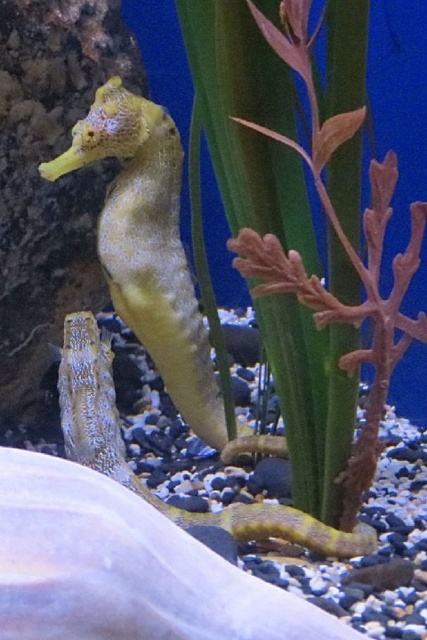
Question: Which point is farther to the camera?

Choices:
 (A) (263, 202)
 (B) (148, 280)

Answer: (B)

Question: Is green matte plant at center smaller than yellow matte seahorse at center?

Choices:
 (A) yes
 (B) no

Answer: (B)

Question: Does green matte plant at center appear on the right side of shiny blue seahorse at center?

Choices:
 (A) no
 (B) yes

Answer: (B)

Question: Does yellow matte seahorse at center have a lesser width compared to shiny blue seahorse at center?

Choices:
 (A) no
 (B) yes

Answer: (B)

Question: Which of the following is the closest to the observer?

Choices:
 (A) green matte plant at center
 (B) shiny blue seahorse at center

Answer: (A)

Question: Estimate the real-world distances between objects in this image. Which object is closer to the yellow matte seahorse at center?

Choices:
 (A) shiny blue seahorse at center
 (B) green matte plant at center

Answer: (A)